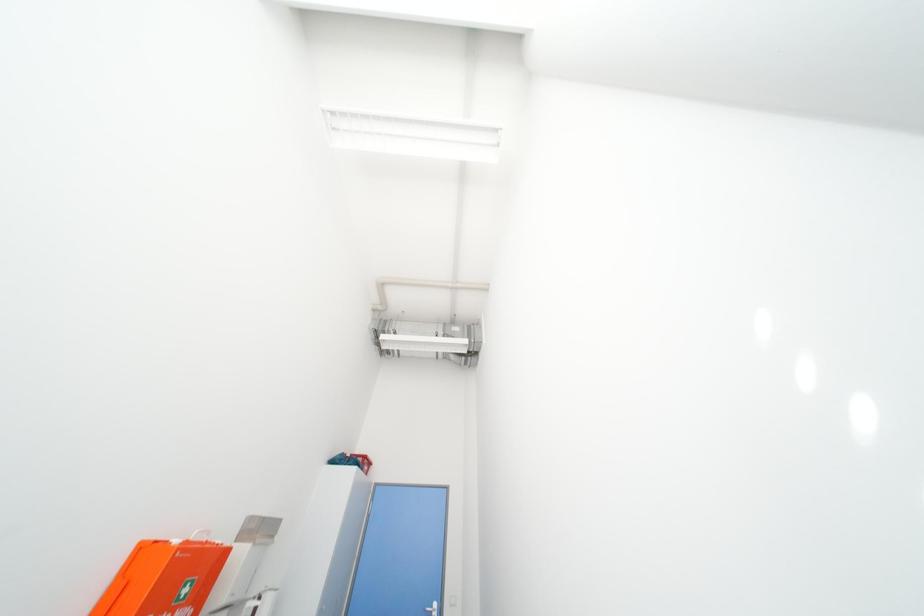
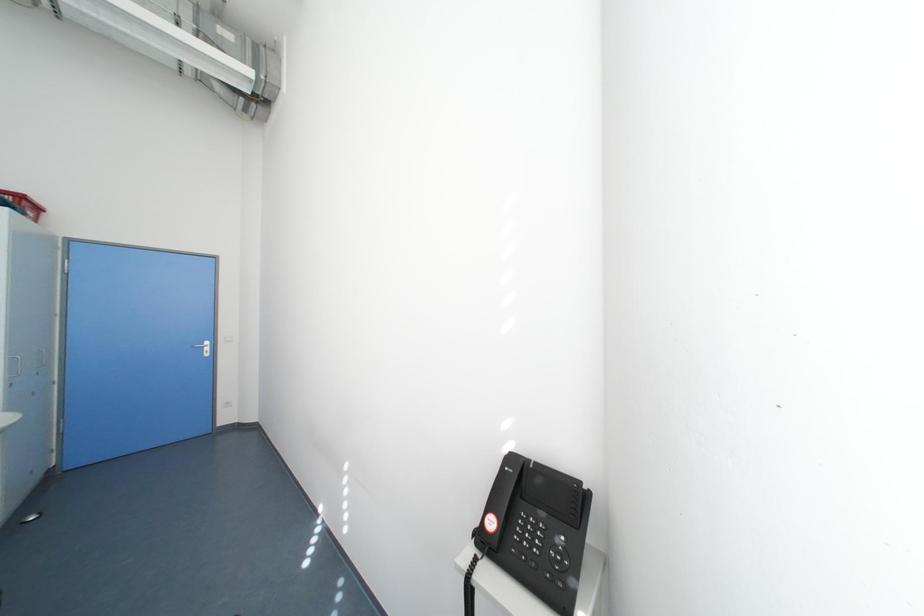
Based on the continuous images, in which direction is the camera rotating?

The camera's rotation is toward right-down.